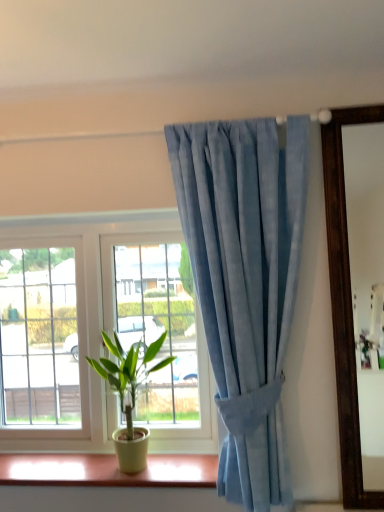
Question: Which is correct: green matte plant at lower left is inside matte yellow plastic at lower center, or outside of it?

Choices:
 (A) outside
 (B) inside

Answer: (A)

Question: Considering the positions of green matte plant at lower left and matte yellow plastic at lower center in the image, is green matte plant at lower left wider or thinner than matte yellow plastic at lower center?

Choices:
 (A) thin
 (B) wide

Answer: (B)

Question: Which object is positioned closest to the green matte plant at lower left?

Choices:
 (A) matte yellow plastic at lower center
 (B) light blue fabric curtain at upper center

Answer: (A)

Question: Based on their relative distances, which object is farther from the matte yellow plastic at lower center?

Choices:
 (A) light blue fabric curtain at upper center
 (B) green matte plant at lower left

Answer: (A)